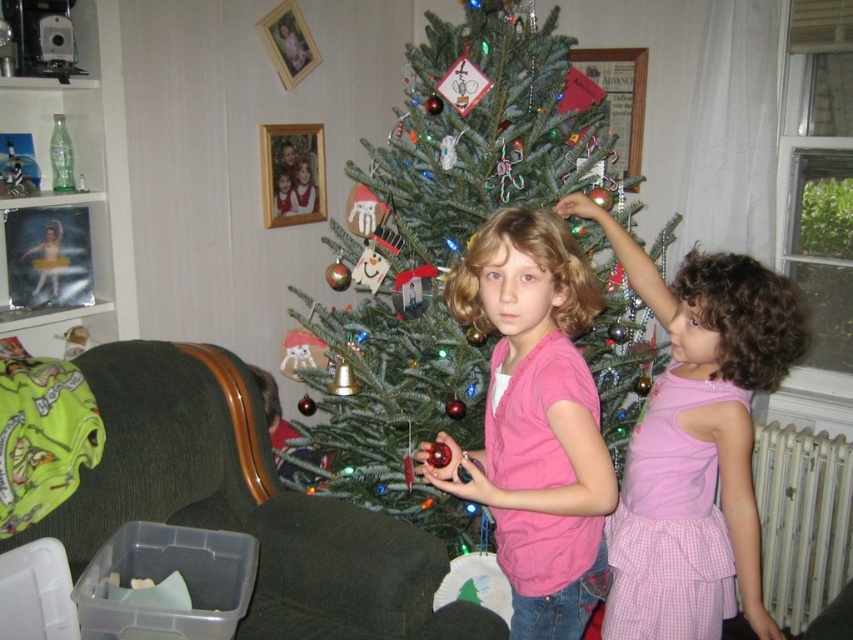
Question: Estimate the real-world distances between objects in this image. Which object is farther from the pink matte shirt at center?

Choices:
 (A) green matte christmas tree at center
 (B) dark green fabric armchair at lower left
 (C) pink cotton dress at center

Answer: (A)

Question: Which object is farther from the camera taking this photo?

Choices:
 (A) green matte christmas tree at center
 (B) dark green fabric armchair at lower left
 (C) pink matte shirt at center
 (D) pink cotton dress at center

Answer: (A)

Question: Among these points, which one is nearest to the camera?

Choices:
 (A) (596, 310)
 (B) (608, 620)
 (C) (361, 448)
 (D) (279, 592)

Answer: (A)

Question: Is pink matte shirt at center to the right of pink cotton dress at center from the viewer's perspective?

Choices:
 (A) no
 (B) yes

Answer: (A)

Question: Is dark green fabric armchair at lower left closer to the viewer compared to pink matte shirt at center?

Choices:
 (A) yes
 (B) no

Answer: (B)

Question: Does dark green fabric armchair at lower left come in front of pink matte shirt at center?

Choices:
 (A) yes
 (B) no

Answer: (B)